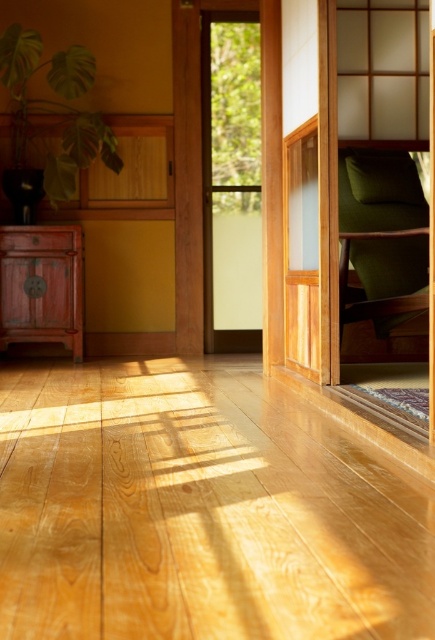
From the picture: Does green fabric armchair at upper right have a lesser width compared to green matte leafy plant at upper left?

Correct, green fabric armchair at upper right's width is less than green matte leafy plant at upper left's.

Does green fabric armchair at upper right appear on the right side of green matte leafy plant at upper left?

Indeed, green fabric armchair at upper right is positioned on the right side of green matte leafy plant at upper left.

Which is in front, point (341, 300) or point (6, 36)?

Positioned in front is point (341, 300).

At what (x,y) coordinates should I click in order to perform the action: click on green fabric armchair at upper right. Please return your answer as a coordinate pair (x, y). Looking at the image, I should click on (381, 237).

Between green matte leafy plant at upper left and matte reddish-brown cabinet at left, which one has more height?

green matte leafy plant at upper left

I want to click on green matte leafy plant at upper left, so tap(52, 115).

Measure the distance between point (82, 163) and camera.

Point (82, 163) and camera are 4.70 meters apart.

At what (x,y) coordinates should I click in order to perform the action: click on green matte leafy plant at upper left. Please return your answer as a coordinate pair (x, y). The height and width of the screenshot is (640, 435). Looking at the image, I should click on (52, 115).

Can you confirm if green fabric armchair at upper right is positioned to the right of matte reddish-brown cabinet at left?

Correct, you'll find green fabric armchair at upper right to the right of matte reddish-brown cabinet at left.

What do you see at coordinates (381, 237) in the screenshot? The height and width of the screenshot is (640, 435). I see `green fabric armchair at upper right` at bounding box center [381, 237].

This screenshot has height=640, width=435. In order to click on green fabric armchair at upper right in this screenshot , I will do coord(381,237).